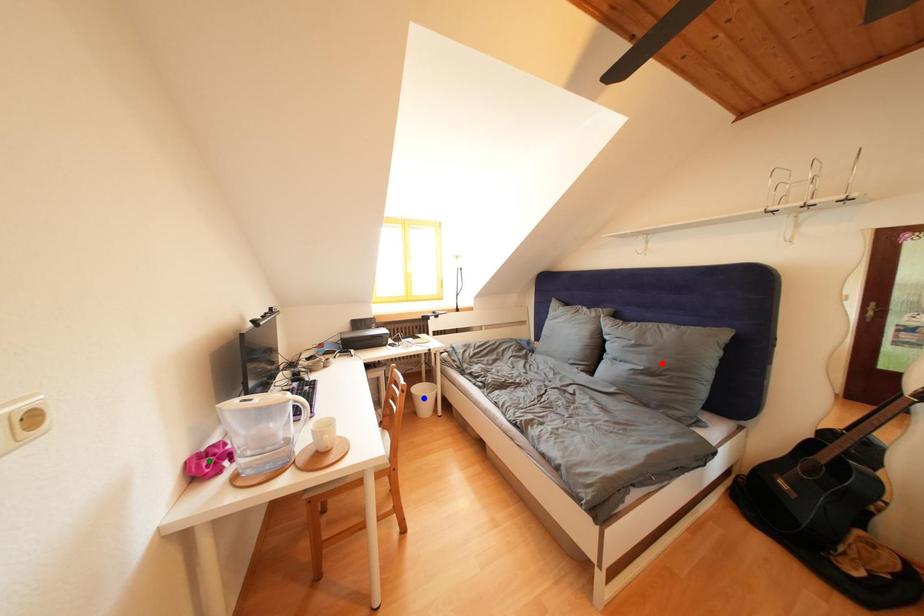
Order these from farthest to nearest:
red point, green point, blue point

blue point < red point < green point